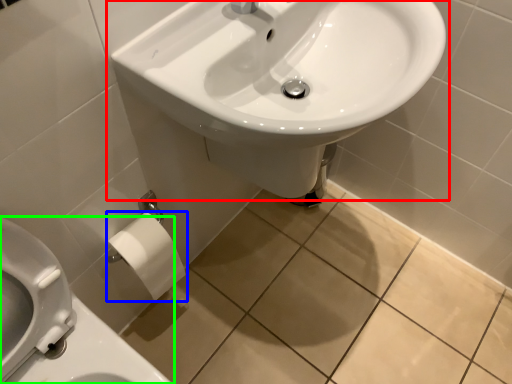
Question: Considering the real-world distances, which object is farthest from sink (highlighted by a red box)? toilet paper (highlighted by a blue box) or toilet (highlighted by a green box)?

Choices:
 (A) toilet paper
 (B) toilet

Answer: (B)